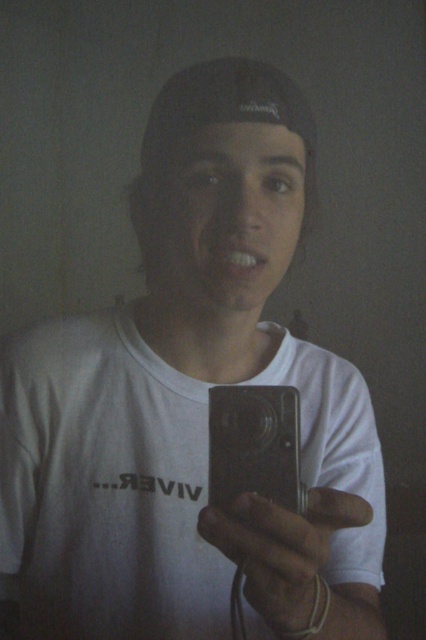
Question: Among these objects, which one is farthest from the camera?

Choices:
 (A) satin silver camera at center
 (B) matte gray phone at center

Answer: (A)

Question: Is matte gray phone at center smaller than satin silver camera at center?

Choices:
 (A) yes
 (B) no

Answer: (B)

Question: Which of the following is the closest to the observer?

Choices:
 (A) matte gray phone at center
 (B) satin silver camera at center

Answer: (A)

Question: Can you confirm if matte gray phone at center is thinner than satin silver camera at center?

Choices:
 (A) no
 (B) yes

Answer: (A)

Question: Which of the following is the closest to the observer?

Choices:
 (A) satin silver camera at center
 (B) matte gray phone at center

Answer: (B)

Question: In this image, where is matte gray phone at center located relative to satin silver camera at center?

Choices:
 (A) left
 (B) right

Answer: (B)